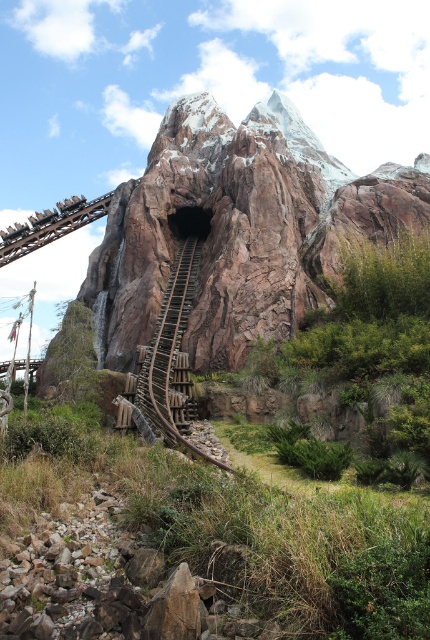
Question: Is rustic wood mountain at center bigger than wooden at center?

Choices:
 (A) no
 (B) yes

Answer: (B)

Question: Is rustic wood mountain at center in front of wooden at center?

Choices:
 (A) yes
 (B) no

Answer: (B)

Question: Which of the following is the closest to the observer?

Choices:
 (A) wooden at center
 (B) rustic wood mountain at center

Answer: (A)

Question: Can you confirm if rustic wood mountain at center is thinner than wooden at center?

Choices:
 (A) no
 (B) yes

Answer: (A)